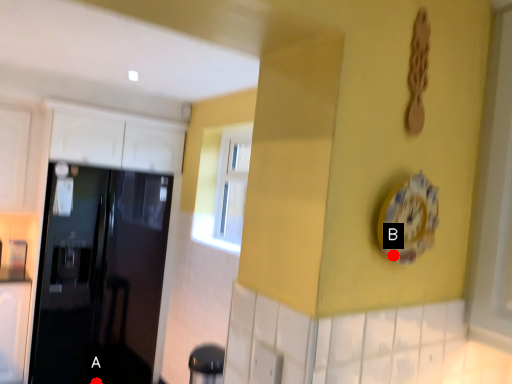
Question: Two points are circled on the image, labeled by A and B beside each circle. Which point appears farthest from the camera in this image?

Choices:
 (A) A is further
 (B) B is further

Answer: (A)